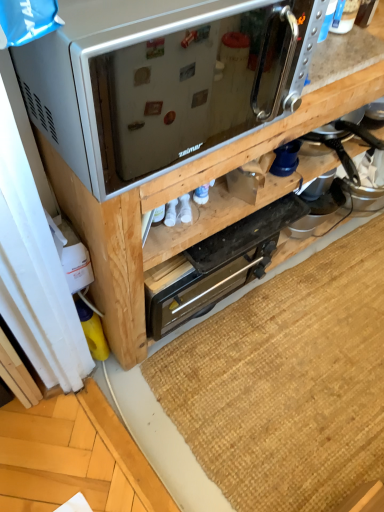
You are a GUI agent. You are given a task and a screenshot of the screen. Output one action in this format:
    pyautogui.click(x=<x>, y=<y>)
    Task: Click on the vacant space situated above brown woven mat at lower center (from a real-world perspective)
    
    Given the screenshot: What is the action you would take?
    pyautogui.click(x=315, y=356)